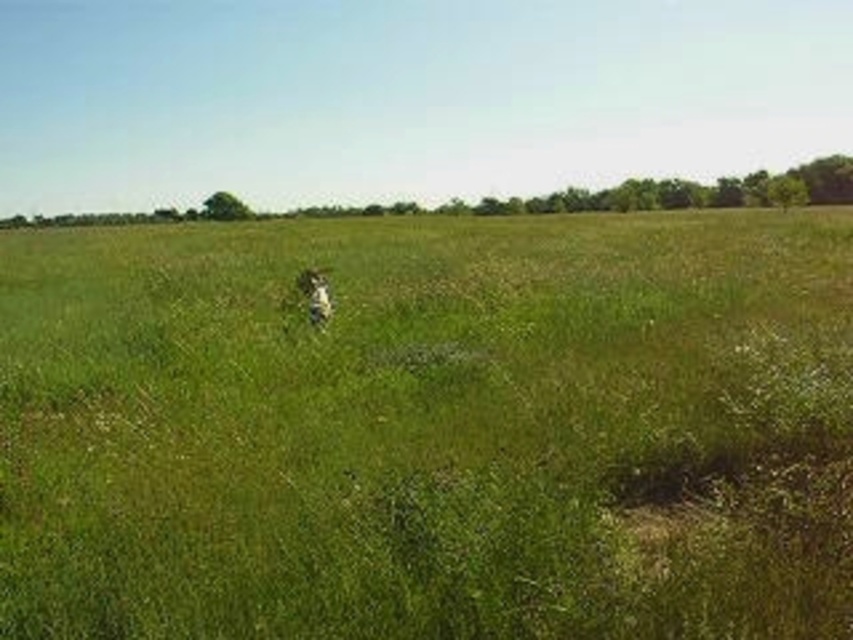
You are standing at point A which is at the center of the field. You want to walk to the point B which is at point coordinates (428, 428). What will you find when you arrive at point B?

At point B which is at coordinates (428, 428), you will find green grassy pasture at center.